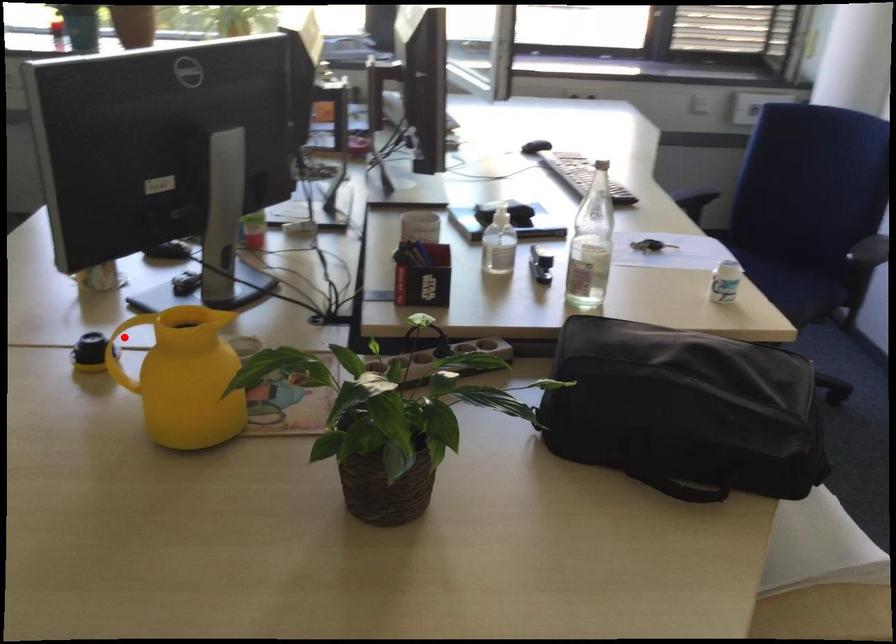
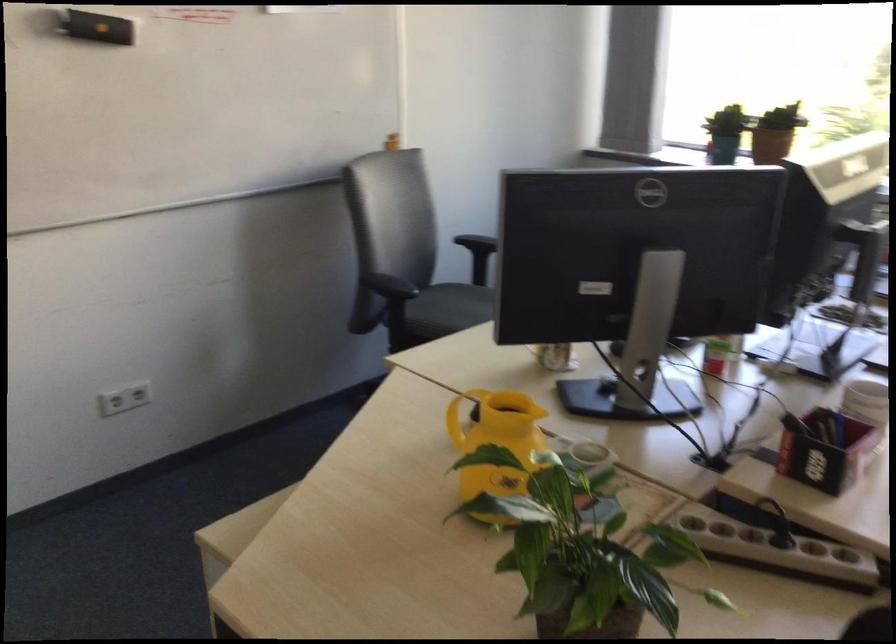
Question: I am providing you with two images of the same scene from different viewpoints. A red point is marked on the first image. Can you still see the location of the red point in image 2?

Choices:
 (A) Yes
 (B) No

Answer: (B)